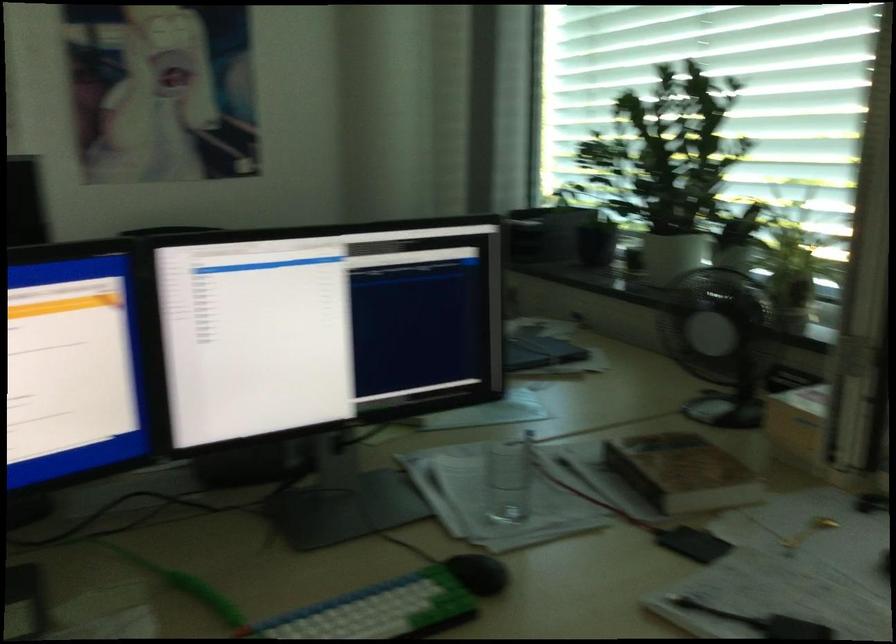
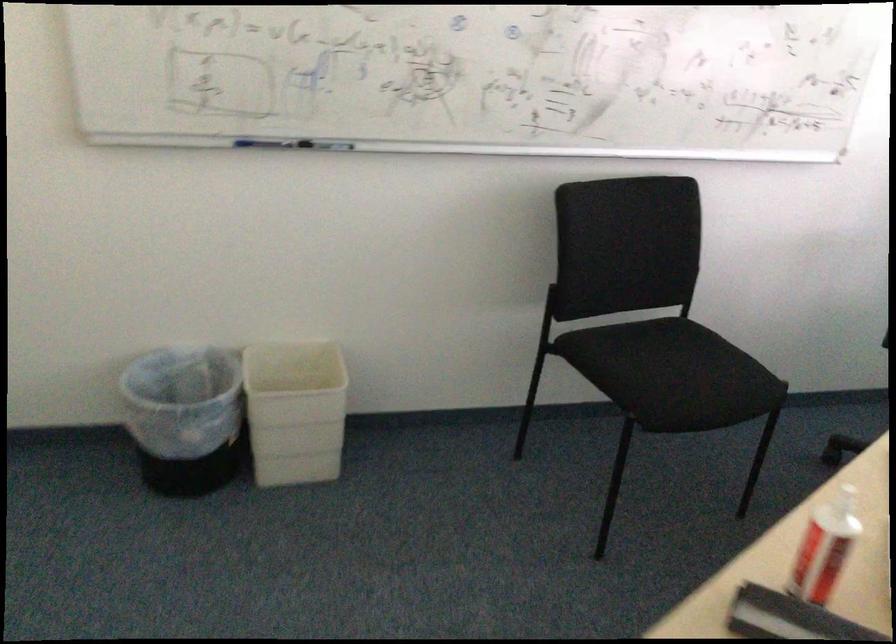
Question: The images are taken continuously from a first-person perspective. In which direction are you moving?

Choices:
 (A) Left
 (B) Right
 (C) Forward
 (D) Backward

Answer: (A)